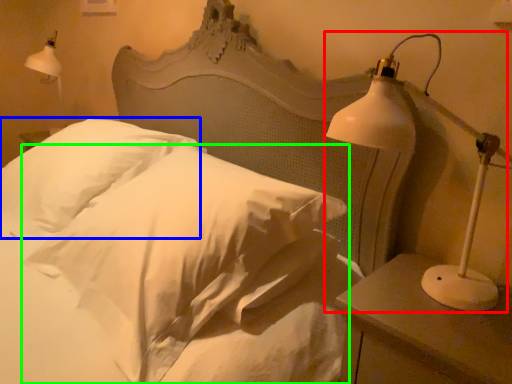
Question: Considering the real-world distances, which object is closest to lamp (highlighted by a red box)? pillow (highlighted by a blue box) or pillow (highlighted by a green box).

Choices:
 (A) pillow
 (B) pillow

Answer: (B)